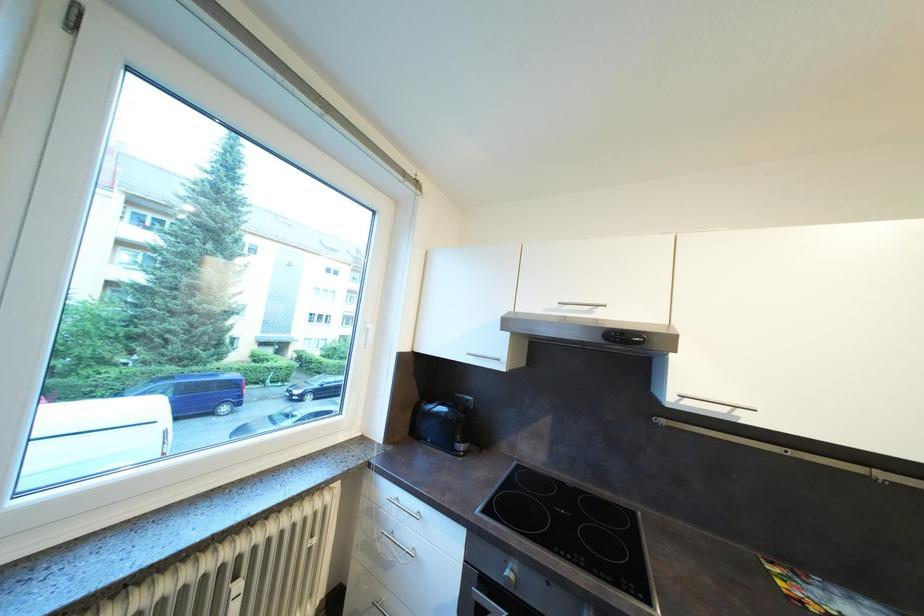
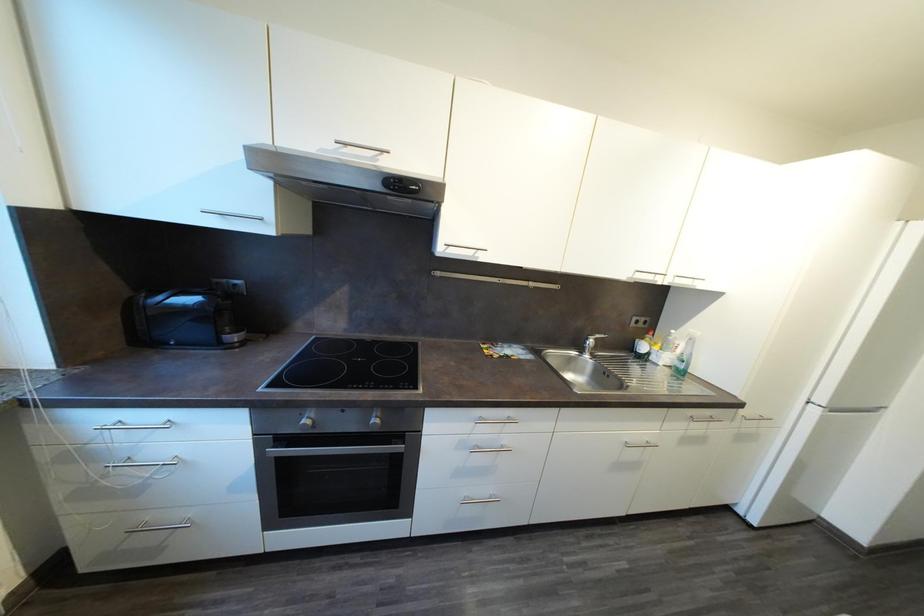
How did the camera likely rotate?

The rotation direction of the camera is right-down.